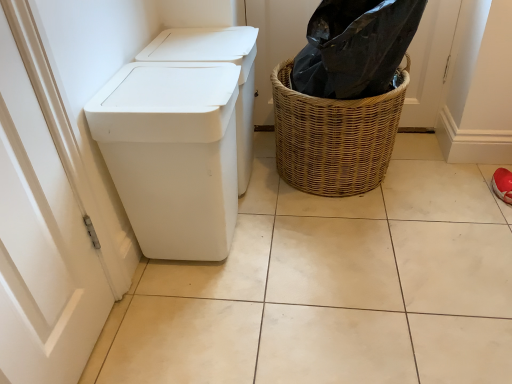
Where is `woven brown basket at right`? This screenshot has width=512, height=384. woven brown basket at right is located at coordinates (334, 136).

What is the approximate height of white matte tile at center?

The height of white matte tile at center is 1.66 inches.

Identify the location of woven brown basket at right. (334, 136).

From the image's perspective, would you say white matte tile at center is shown under white plastic waste container at left?

Yes, from the image's perspective, white matte tile at center is beneath white plastic waste container at left.

From the picture: In terms of size, does white matte tile at center appear bigger or smaller than white plastic waste container at left?

Clearly, white matte tile at center is larger in size than white plastic waste container at left.

Between white matte tile at center and white plastic waste container at left, which one has more height?

white plastic waste container at left.

Where is `tile on the right of white plastic waste container at left`? This screenshot has height=384, width=512. tile on the right of white plastic waste container at left is located at coordinates (332, 287).

From the image's perspective, between white matte tile at center and woven brown basket at right, which one is located above?

From the image's view, woven brown basket at right is above.

Which of these two, white matte tile at center or woven brown basket at right, stands taller?

Standing taller between the two is woven brown basket at right.

Considering the sizes of white matte tile at center and woven brown basket at right in the image, is white matte tile at center wider or thinner than woven brown basket at right?

white matte tile at center is wider than woven brown basket at right.

Is white plastic waste container at left thinner than woven brown basket at right?

Yes, white plastic waste container at left is thinner than woven brown basket at right.

Is white plastic waste container at left not within woven brown basket at right?

Yes.

In the scene shown: From the image's perspective, is white plastic waste container at left located beneath woven brown basket at right?

Yes, from the image's perspective, white plastic waste container at left is beneath woven brown basket at right.

Identify the location of basket above the white plastic waste container at left (from the image's perspective). This screenshot has width=512, height=384. (334, 136).

Is woven brown basket at right spatially inside white matte tile at center, or outside of it?

woven brown basket at right is outside white matte tile at center.

In the scene shown: In the image, is woven brown basket at right on the left side or the right side of white matte tile at center?

woven brown basket at right is positioned on white matte tile at center's right side.

From the image's perspective, relative to white matte tile at center, is woven brown basket at right above or below?

woven brown basket at right is above white matte tile at center.

Looking at this image, is woven brown basket at right looking in the opposite direction of white matte tile at center?

No, woven brown basket at right is not facing the opposite direction of white matte tile at center.

From the image's perspective, is white plastic waste container at left beneath white matte tile at center?

No, from the image's perspective, white plastic waste container at left is not below white matte tile at center.

Is white plastic waste container at left to the right of white matte tile at center from the viewer's perspective?

Incorrect, white plastic waste container at left is not on the right side of white matte tile at center.

Considering the points (213, 89) and (480, 247), which point is behind, point (213, 89) or point (480, 247)?

The point (480, 247) is farther from the camera.

You are a GUI agent. You are given a task and a screenshot of the screen. Output one action in this format:
    pyautogui.click(x=<x>, y=<y>)
    Task: Click on the basket below the white plastic waste container at left (from a real-world perspective)
    
    Given the screenshot: What is the action you would take?
    coord(334,136)

From the picture: Do you think woven brown basket at right is within white plastic waste container at left, or outside of it?

woven brown basket at right exists outside the volume of white plastic waste container at left.

In order to click on tile that is under the white plastic waste container at left (from a real-world perspective) in this screenshot , I will do `click(332, 287)`.

Locate an element on the screen. tile on the left of woven brown basket at right is located at coordinates (332, 287).

When comparing their distances from woven brown basket at right, does white plastic waste container at left or white matte tile at center seem closer?

The object closer to woven brown basket at right is white matte tile at center.

Looking at the image, which one is located closer to white plastic waste container at left, white matte tile at center or woven brown basket at right?

Among the two, white matte tile at center is located nearer to white plastic waste container at left.

Estimate the real-world distances between objects in this image. Which object is closer to white plastic waste container at left, woven brown basket at right or white matte tile at center?

white matte tile at center is closer to white plastic waste container at left.

When comparing their distances from white matte tile at center, does white plastic waste container at left or woven brown basket at right seem closer?

woven brown basket at right is closer to white matte tile at center.

Estimate the real-world distances between objects in this image. Which object is closer to woven brown basket at right, white matte tile at center or white plastic waste container at left?

white matte tile at center.

Estimate the real-world distances between objects in this image. Which object is closer to white matte tile at center, woven brown basket at right or white plastic waste container at left?

woven brown basket at right.

Where is `tile located between white plastic waste container at left and woven brown basket at right in the left-right direction`? tile located between white plastic waste container at left and woven brown basket at right in the left-right direction is located at coordinates (332, 287).